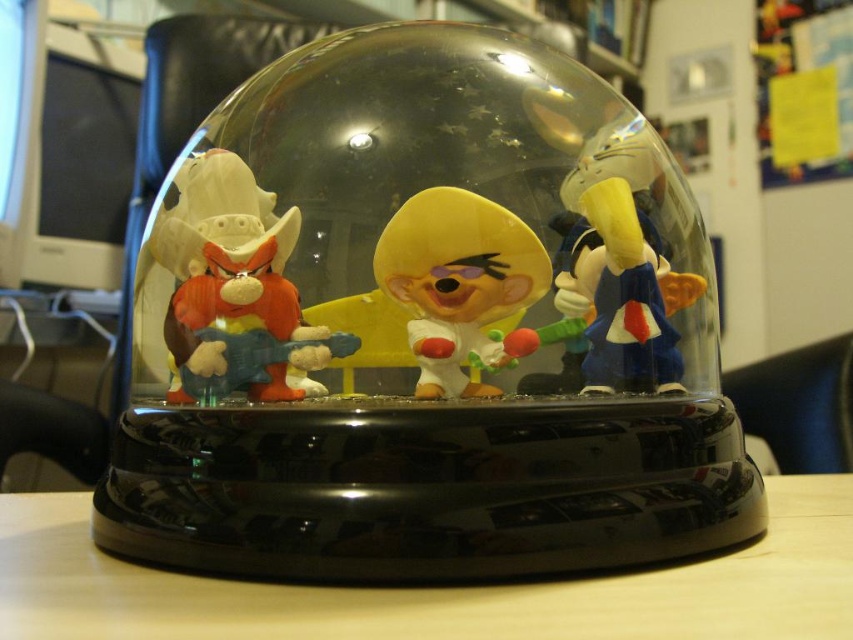
Which is in front, point (630, 275) or point (628, 636)?

Positioned in front is point (628, 636).

Between point (544, 294) and point (15, 538), which one is positioned behind?

The point (15, 538) is behind.

Is point (358, 509) farther from camera compared to point (767, 502)?

That is False.

Identify the location of matte plastic toy at center. (425, 326).

Which is in front, point (827, 632) or point (457, 252)?

Point (827, 632) is more forward.

Image resolution: width=853 pixels, height=640 pixels. In order to click on wooden at center in this screenshot , I will do `click(437, 588)`.

At what (x,y) coordinates should I click in order to perform the action: click on wooden at center. Please return your answer as a coordinate pair (x, y). The width and height of the screenshot is (853, 640). Looking at the image, I should click on point(437,588).

Can you confirm if wooden at center is bigger than matte plastic figurine at left?

Indeed, wooden at center has a larger size compared to matte plastic figurine at left.

The width and height of the screenshot is (853, 640). I want to click on wooden at center, so click(437, 588).

Locate an element on the screen. This screenshot has height=640, width=853. wooden at center is located at coordinates (437, 588).